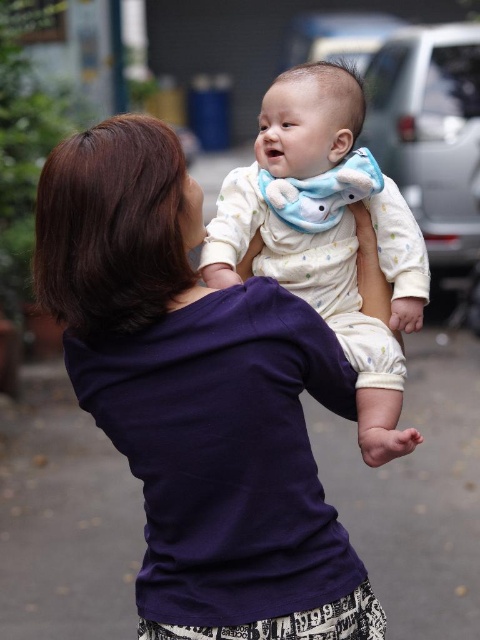
Question: Is purple cotton shirt at center positioned in front of white dotted fabric at center?

Choices:
 (A) yes
 (B) no

Answer: (A)

Question: Which object is closer to the camera taking this photo?

Choices:
 (A) purple cotton shirt at center
 (B) white dotted fabric at center

Answer: (A)

Question: Which object is farther from the camera taking this photo?

Choices:
 (A) white dotted fabric at center
 (B) purple cotton shirt at center

Answer: (A)

Question: Does purple cotton shirt at center have a smaller size compared to white dotted fabric at center?

Choices:
 (A) no
 (B) yes

Answer: (A)

Question: Where is purple cotton shirt at center located in relation to white dotted fabric at center in the image?

Choices:
 (A) above
 (B) below

Answer: (B)